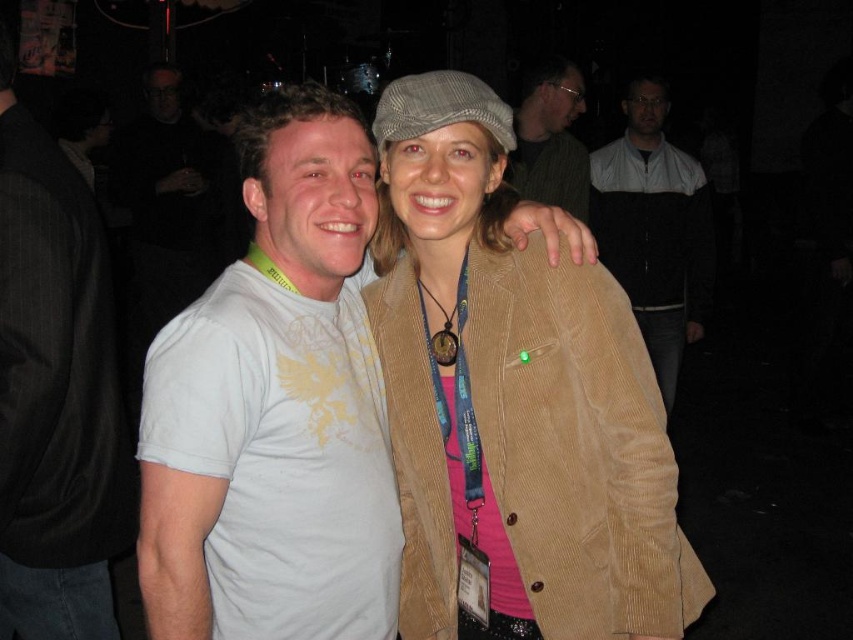
Question: Where is white cotton t-shirt at left located in relation to matte black jacket at upper center in the image?

Choices:
 (A) below
 (B) above

Answer: (A)

Question: Does black corduroy jacket at center lie in front of matte black jacket at upper center?

Choices:
 (A) no
 (B) yes

Answer: (A)

Question: Among these points, which one is nearest to the camera?

Choices:
 (A) (381, 493)
 (B) (585, 193)
 (C) (677, 353)
 (D) (61, 253)

Answer: (A)

Question: Is white cotton t-shirt at left to the right of black corduroy jacket at center from the viewer's perspective?

Choices:
 (A) yes
 (B) no

Answer: (B)

Question: Which point is closer to the camera?

Choices:
 (A) white cotton t-shirt at left
 (B) corduroy blazer at center
 (C) white cotton t-shirt at center
 (D) black corduroy jacket at center

Answer: (C)

Question: Which object is positioned farthest from the white cotton t-shirt at center?

Choices:
 (A) matte black jacket at upper center
 (B) corduroy blazer at center
 (C) white cotton t-shirt at left

Answer: (A)